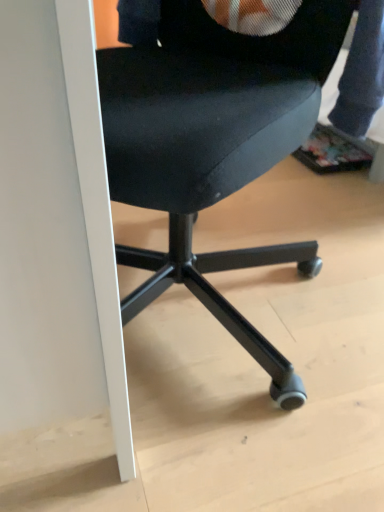
What are the coordinates of `vacant space underneath black leather chair at center (from a real-world perspective)` in the screenshot? It's located at (217, 327).